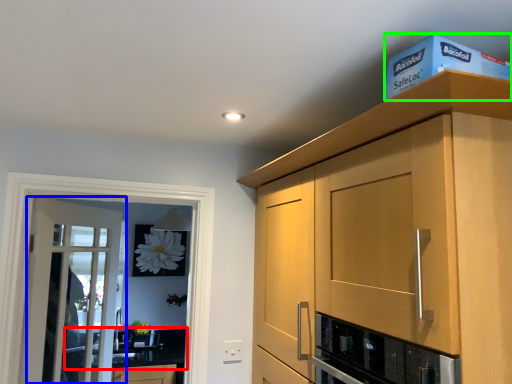
Question: Based on their relative distances, which object is farther from countertop (highlighted by a red box)? Choose from door (highlighted by a blue box) and box (highlighted by a green box).

Choices:
 (A) door
 (B) box

Answer: (B)